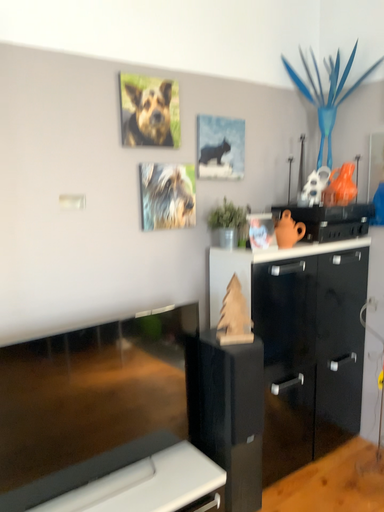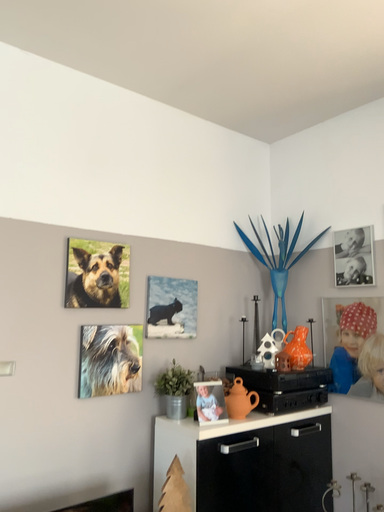
Question: How did the camera likely rotate when shooting the video?

Choices:
 (A) rotated downward
 (B) rotated upward

Answer: (B)